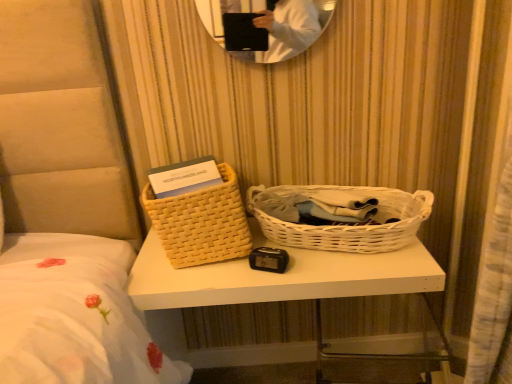
Where is `woven beige basket at left, which appears as the second picnic basket when viewed from the right`? The width and height of the screenshot is (512, 384). woven beige basket at left, which appears as the second picnic basket when viewed from the right is located at coordinates (201, 223).

Find the location of a particular element. The image size is (512, 384). woven beige basket at left, which appears as the second picnic basket when viewed from the right is located at coordinates (201, 223).

Can you see white woven basket at center touching woven beige basket at left, which appears as the second picnic basket when viewed from the right?

No, white woven basket at center is not next to woven beige basket at left, which appears as the second picnic basket when viewed from the right.

Is point (341, 271) positioned before point (154, 209)?

That is False.

Consider the image. Does white woven basket at center have a smaller size compared to woven beige basket at left, which appears as the second picnic basket when viewed from the right?

Actually, white woven basket at center might be larger than woven beige basket at left, which appears as the second picnic basket when viewed from the right.

Consider the image. Which object is more forward, white woven basket at center or woven beige basket at left, which appears as the second picnic basket when viewed from the right?

white woven basket at center is closer to the camera.

Considering the points (206, 197) and (200, 281), which point is in front, point (206, 197) or point (200, 281)?

The point (200, 281) is closer.

From the image's perspective, would you say woven beige basket at left, which appears as the second picnic basket when viewed from the right, is positioned over white woven basket at center?

Indeed, from the image's perspective, woven beige basket at left, which appears as the second picnic basket when viewed from the right, is shown above white woven basket at center.

Consider the image. Would you say woven beige basket at left, which appears as the 1th picnic basket when viewed from the left, is inside or outside white woven basket at center?

woven beige basket at left, which appears as the 1th picnic basket when viewed from the left, is spatially situated outside white woven basket at center.

Is woven beige basket at left, which appears as the 1th picnic basket when viewed from the left, looking in the opposite direction of white woven basket at center?

No, woven beige basket at left, which appears as the 1th picnic basket when viewed from the left, is not facing away from white woven basket at center.

Which is behind, point (169, 246) or point (284, 212)?

Positioned behind is point (284, 212).

Considering the sizes of objects woven beige basket at left, which appears as the second picnic basket when viewed from the right, and white wicker picnic basket at center, placed as the second picnic basket when sorted from left to right, in the image provided, who is taller, woven beige basket at left, which appears as the second picnic basket when viewed from the right, or white wicker picnic basket at center, placed as the second picnic basket when sorted from left to right,?

With more height is woven beige basket at left, which appears as the second picnic basket when viewed from the right.

This screenshot has width=512, height=384. Identify the location of picnic basket on the left of the white wicker picnic basket at center, which is counted as the 1th picnic basket, starting from the right. (201, 223).

Is woven beige basket at left, which appears as the second picnic basket when viewed from the right, next to white wicker picnic basket at center, placed as the second picnic basket when sorted from left to right, and touching it?

No, woven beige basket at left, which appears as the second picnic basket when viewed from the right, is not next to white wicker picnic basket at center, placed as the second picnic basket when sorted from left to right.

Is white wicker picnic basket at center, which is counted as the 1th picnic basket, starting from the right, thinner than woven beige basket at left, which appears as the 1th picnic basket when viewed from the left?

No.

Is the position of white wicker picnic basket at center, placed as the second picnic basket when sorted from left to right, more distant than that of woven beige basket at left, which appears as the second picnic basket when viewed from the right?

No, it is in front of woven beige basket at left, which appears as the second picnic basket when viewed from the right.

Could woven beige basket at left, which appears as the 1th picnic basket when viewed from the left, be considered to be inside white wicker picnic basket at center, which is counted as the 1th picnic basket, starting from the right?

No.

Is white wicker picnic basket at center, placed as the second picnic basket when sorted from left to right, aimed at woven beige basket at left, which appears as the 1th picnic basket when viewed from the left?

No.

Is white woven basket at center wider than white wicker picnic basket at center, placed as the second picnic basket when sorted from left to right?

Yes.

Is white woven basket at center surrounding white wicker picnic basket at center, which is counted as the 1th picnic basket, starting from the right?

No, white wicker picnic basket at center, which is counted as the 1th picnic basket, starting from the right, is not surrounded by white woven basket at center.

Are white woven basket at center and white wicker picnic basket at center, placed as the second picnic basket when sorted from left to right, located far from each other?

That's not correct — white woven basket at center is a little close to white wicker picnic basket at center, placed as the second picnic basket when sorted from left to right.

Is white woven basket at center facing away from white wicker picnic basket at center, which is counted as the 1th picnic basket, starting from the right?

No, white woven basket at center is not facing the opposite direction of white wicker picnic basket at center, which is counted as the 1th picnic basket, starting from the right.

From the image's perspective, which is above, white wicker picnic basket at center, which is counted as the 1th picnic basket, starting from the right, or white woven basket at center?

white wicker picnic basket at center, which is counted as the 1th picnic basket, starting from the right, appears higher in the image.

From the picture: From their relative heights in the image, would you say white wicker picnic basket at center, which is counted as the 1th picnic basket, starting from the right, is taller or shorter than white woven basket at center?

In the image, white wicker picnic basket at center, which is counted as the 1th picnic basket, starting from the right, appears to be shorter than white woven basket at center.

Does white wicker picnic basket at center, which is counted as the 1th picnic basket, starting from the right, have a greater width compared to white woven basket at center?

In fact, white wicker picnic basket at center, which is counted as the 1th picnic basket, starting from the right, might be narrower than white woven basket at center.

Locate an element on the screen. The height and width of the screenshot is (384, 512). table in front of the woven beige basket at left, which appears as the 1th picnic basket when viewed from the left is located at coordinates (279, 276).

Find the location of a particular element. The width and height of the screenshot is (512, 384). table that is below the woven beige basket at left, which appears as the second picnic basket when viewed from the right (from the image's perspective) is located at coordinates (279, 276).

When comparing their distances from white wicker picnic basket at center, placed as the second picnic basket when sorted from left to right, does woven beige basket at left, which appears as the 1th picnic basket when viewed from the left, or white woven basket at center seem closer?

Among the two, white woven basket at center is located nearer to white wicker picnic basket at center, placed as the second picnic basket when sorted from left to right.

Which object lies nearer to the anchor point white woven basket at center, white wicker picnic basket at center, placed as the second picnic basket when sorted from left to right, or woven beige basket at left, which appears as the 1th picnic basket when viewed from the left?

Based on the image, white wicker picnic basket at center, placed as the second picnic basket when sorted from left to right, appears to be nearer to white woven basket at center.

Considering their positions, is white woven basket at center positioned closer to woven beige basket at left, which appears as the 1th picnic basket when viewed from the left, than white wicker picnic basket at center, placed as the second picnic basket when sorted from left to right?

The object closer to woven beige basket at left, which appears as the 1th picnic basket when viewed from the left, is white woven basket at center.

Based on their spatial positions, is woven beige basket at left, which appears as the 1th picnic basket when viewed from the left, or white wicker picnic basket at center, placed as the second picnic basket when sorted from left to right, closer to white woven basket at center?

white wicker picnic basket at center, placed as the second picnic basket when sorted from left to right, lies closer to white woven basket at center than the other object.

Considering their positions, is white wicker picnic basket at center, which is counted as the 1th picnic basket, starting from the right, positioned further to woven beige basket at left, which appears as the second picnic basket when viewed from the right, than white woven basket at center?

white wicker picnic basket at center, which is counted as the 1th picnic basket, starting from the right, lies further to woven beige basket at left, which appears as the second picnic basket when viewed from the right, than the other object.

From the picture: Based on their spatial positions, is white woven basket at center or woven beige basket at left, which appears as the second picnic basket when viewed from the right, closer to white wicker picnic basket at center, placed as the second picnic basket when sorted from left to right?

Among the two, white woven basket at center is located nearer to white wicker picnic basket at center, placed as the second picnic basket when sorted from left to right.

The height and width of the screenshot is (384, 512). Find the location of `table between woven beige basket at left, which appears as the second picnic basket when viewed from the right, and white wicker picnic basket at center, which is counted as the 1th picnic basket, starting from the right, in the horizontal direction`. table between woven beige basket at left, which appears as the second picnic basket when viewed from the right, and white wicker picnic basket at center, which is counted as the 1th picnic basket, starting from the right, in the horizontal direction is located at coordinates (279, 276).